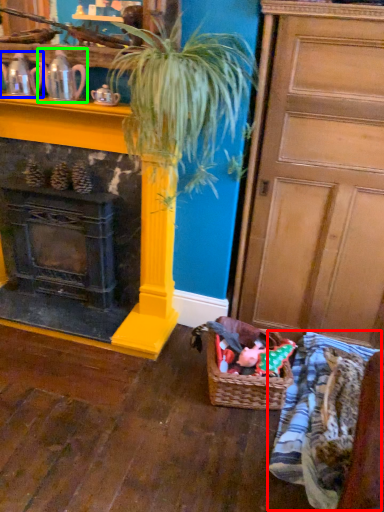
Question: Which object is positioned closest to clothing (highlighted by a red box)? Select from tea pot (highlighted by a blue box) and tea pot (highlighted by a green box).

Choices:
 (A) tea pot
 (B) tea pot

Answer: (B)